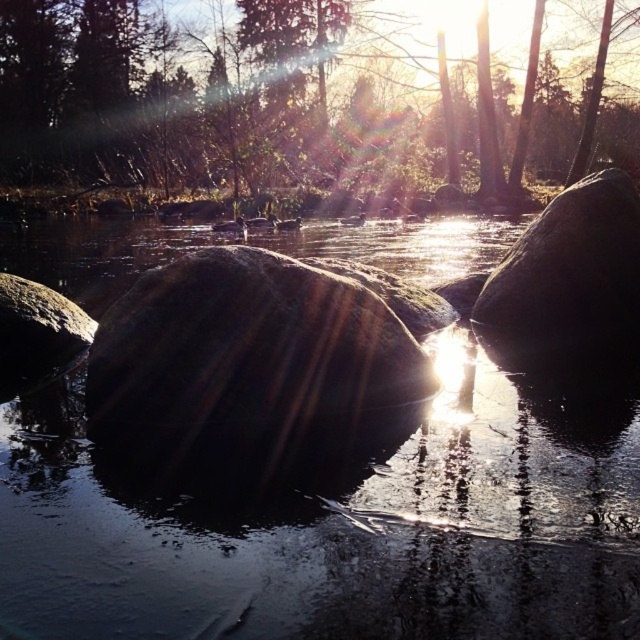
Question: Can you confirm if green matte tree at upper center is positioned to the right of shiny dark rock at right?

Choices:
 (A) no
 (B) yes

Answer: (A)

Question: Among these points, which one is nearest to the camera?

Choices:
 (A) (595, 339)
 (B) (17, 163)
 (C) (17, 378)

Answer: (C)

Question: Is shiny dark rock at right above smooth gray rock at left?

Choices:
 (A) no
 (B) yes

Answer: (B)

Question: Based on their relative distances, which object is farther from the smooth gray rock at left?

Choices:
 (A) glossy rock at center
 (B) smooth rock at center
 (C) shiny dark rock at right
 (D) green matte tree at upper center

Answer: (D)

Question: Which of the following is the closest to the observer?

Choices:
 (A) glossy rock at center
 (B) shiny dark rock at right
 (C) smooth rock at center

Answer: (A)

Question: Can you confirm if shiny dark rock at right is thinner than smooth gray rock at left?

Choices:
 (A) yes
 (B) no

Answer: (B)